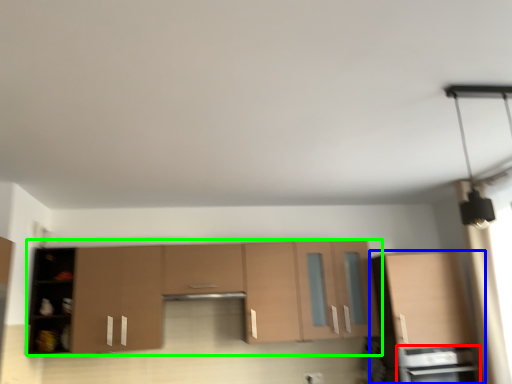
Question: Based on their relative distances, which object is farther from appliance (highlighted by a red box)? Choose from cabinetry (highlighted by a blue box) and cabinetry (highlighted by a green box).

Choices:
 (A) cabinetry
 (B) cabinetry

Answer: (B)